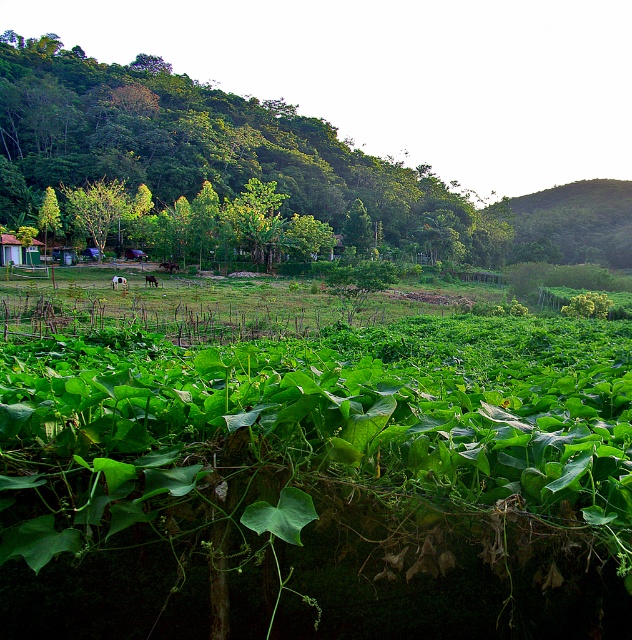
Question: Can you confirm if green leafy hillside at upper right is positioned above white woolly sheep at center?

Choices:
 (A) yes
 (B) no

Answer: (A)

Question: Which point is closer to the camera?

Choices:
 (A) (112, 280)
 (B) (380, 202)
 (C) (154, 276)
 (D) (602, 252)

Answer: (A)

Question: Among these points, which one is farthest from the camera?

Choices:
 (A) (624, 189)
 (B) (116, 285)

Answer: (A)

Question: Among these objects, which one is nearest to the camera?

Choices:
 (A) green leafy hillside at upper right
 (B) green leafy tree at center

Answer: (B)

Question: Is green leafy tree at center below white woolly sheep at center?

Choices:
 (A) yes
 (B) no

Answer: (B)

Question: Does green leafy hillside at upper right appear under brown furry horse at center?

Choices:
 (A) yes
 (B) no

Answer: (B)